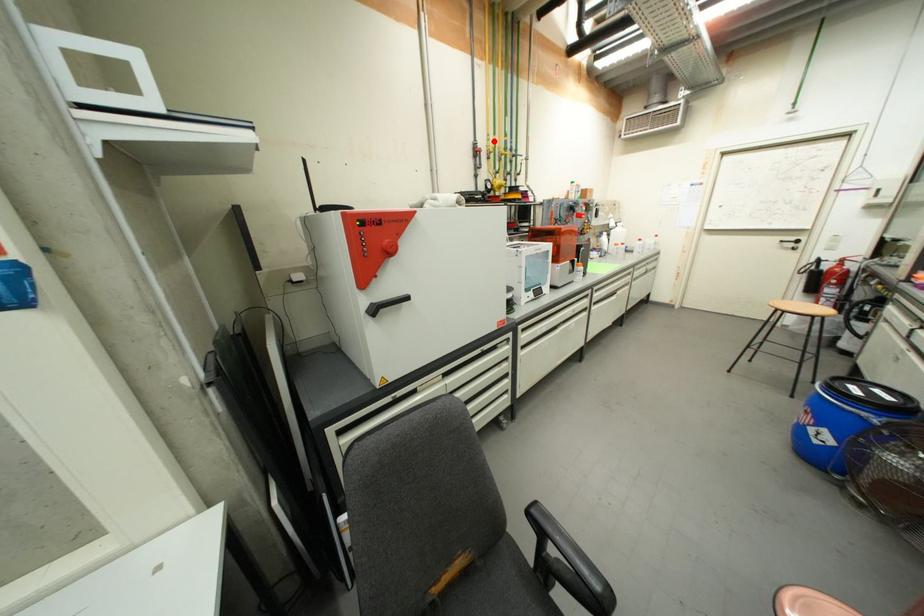
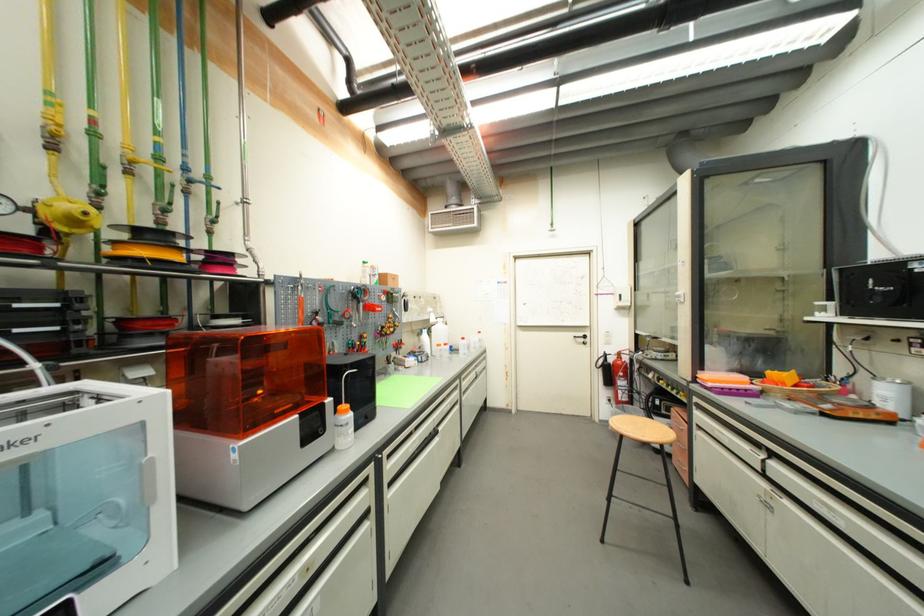
The point at the highlighted location is marked in the first image. Where is the corresponding point in the second image?

(55, 106)